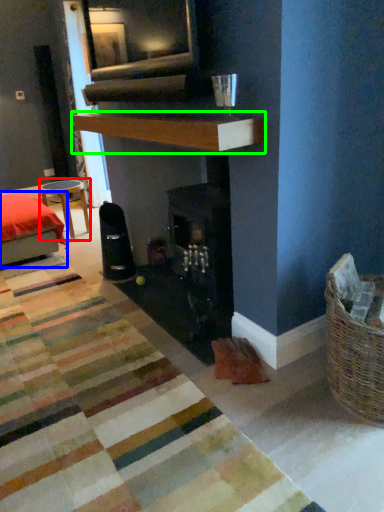
Question: Considering the real-world distances, which object is farthest from table (highlighted by a red box)? furniture (highlighted by a blue box) or mantle (highlighted by a green box)?

Choices:
 (A) furniture
 (B) mantle

Answer: (B)